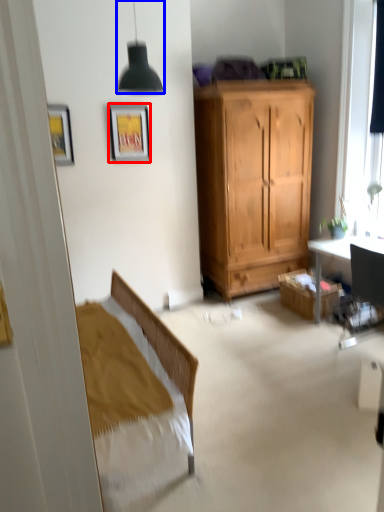
Question: Which object is closer to the camera taking this photo, picture frame (highlighted by a red box) or lamp (highlighted by a blue box)?

Choices:
 (A) picture frame
 (B) lamp

Answer: (B)